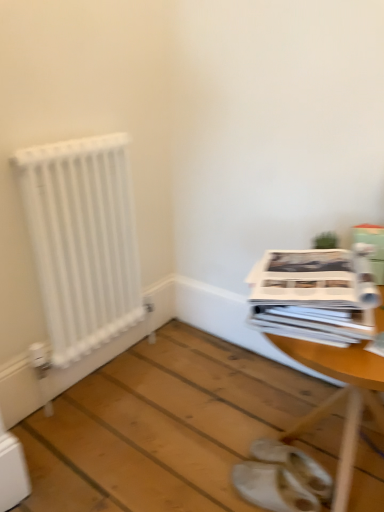
Question: Could green cardboard box at upper right be considered to be inside white leather sandals at lower center?

Choices:
 (A) yes
 (B) no

Answer: (B)

Question: Is white leather sandals at lower center positioned with its back to green cardboard box at upper right?

Choices:
 (A) yes
 (B) no

Answer: (B)

Question: Is the surface of white leather sandals at lower center in direct contact with green cardboard box at upper right?

Choices:
 (A) yes
 (B) no

Answer: (B)

Question: From the image's perspective, does white leather sandals at lower center appear higher than green cardboard box at upper right?

Choices:
 (A) no
 (B) yes

Answer: (A)

Question: Can you confirm if white leather sandals at lower center is taller than green cardboard box at upper right?

Choices:
 (A) no
 (B) yes

Answer: (A)

Question: Is white leather sandals at lower center at the left side of green cardboard box at upper right?

Choices:
 (A) no
 (B) yes

Answer: (B)

Question: From a real-world perspective, is wooden table at center located beneath white matte radiator at left?

Choices:
 (A) no
 (B) yes

Answer: (B)

Question: Would you consider wooden table at center to be distant from white matte radiator at left?

Choices:
 (A) no
 (B) yes

Answer: (A)

Question: Is wooden table at center taller than white matte radiator at left?

Choices:
 (A) no
 (B) yes

Answer: (A)

Question: Can you confirm if wooden table at center is wider than white matte radiator at left?

Choices:
 (A) no
 (B) yes

Answer: (B)

Question: Can you confirm if wooden table at center is bigger than white matte radiator at left?

Choices:
 (A) yes
 (B) no

Answer: (A)

Question: Can you confirm if wooden table at center is positioned to the right of white matte radiator at left?

Choices:
 (A) yes
 (B) no

Answer: (A)

Question: Is white leather sandals at lower center to the right of white glossy magazine at right from the viewer's perspective?

Choices:
 (A) yes
 (B) no

Answer: (B)